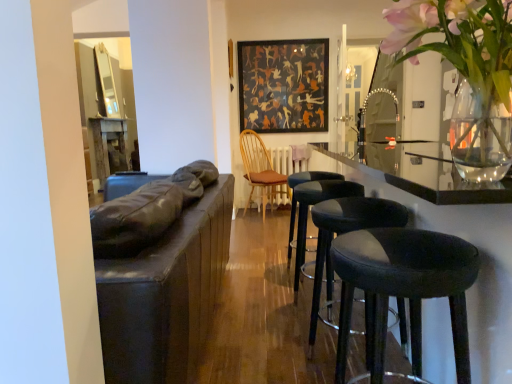
Where is `free location to the left of black leather stool at center, the second stool when ordered from front to back`? The image size is (512, 384). free location to the left of black leather stool at center, the second stool when ordered from front to back is located at coordinates (272, 356).